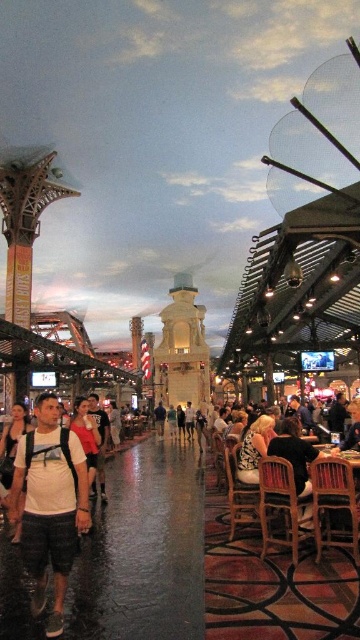
Question: Is white matte t-shirt at lower left positioned at the back of matte black backpack at center?

Choices:
 (A) yes
 (B) no

Answer: (B)

Question: Which point appears farthest from the camera in this image?

Choices:
 (A) (97, 461)
 (B) (294, 435)

Answer: (A)

Question: Can you confirm if white matte t-shirt at lower left is positioned to the right of dark brown leather chair at lower right?

Choices:
 (A) no
 (B) yes

Answer: (A)

Question: Which point is farther to the camera?

Choices:
 (A) (41, 563)
 (B) (284, 445)
 (C) (96, 467)

Answer: (C)

Question: In this image, where is white matte t-shirt at lower left located relative to matte black backpack at center?

Choices:
 (A) above
 (B) below

Answer: (B)

Question: Which point is closer to the camera?

Choices:
 (A) white cotton shirt at center
 (B) matte black backpack at center
 (C) dark brown leather chair at lower right

Answer: (A)